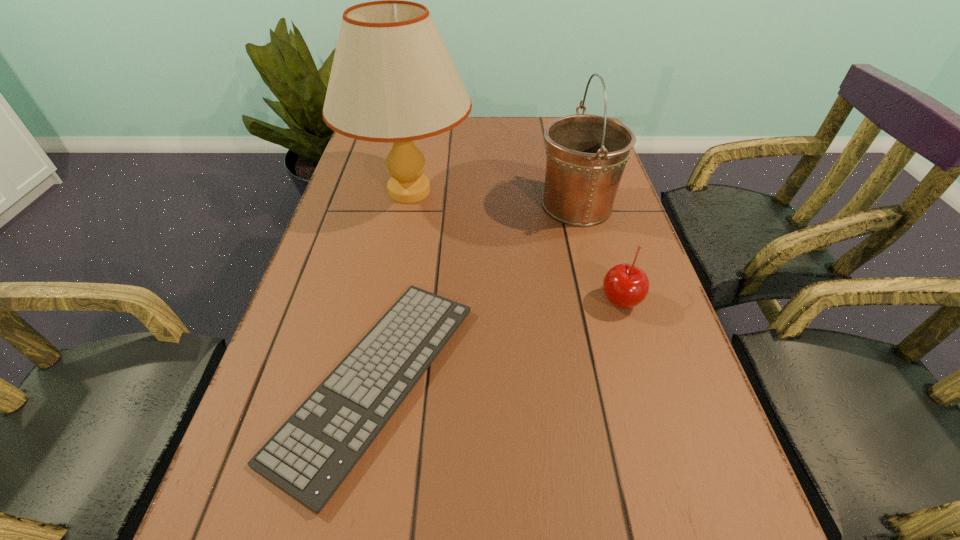
The image size is (960, 540). In order to click on bucket present at the right edge in this screenshot , I will do `click(586, 154)`.

The width and height of the screenshot is (960, 540). I want to click on cherry situated at the right edge, so click(x=625, y=286).

In the image, there is a desktop. Where is `free space at the far edge`? The width and height of the screenshot is (960, 540). free space at the far edge is located at coordinates (466, 144).

In the image, there is a desktop. What are the coordinates of `vacant space at the left edge` in the screenshot? It's located at pos(391,201).

Locate an element on the screen. The height and width of the screenshot is (540, 960). vacant area at the right edge is located at coordinates (592, 244).

Where is `free space between the cherry and the bucket`? free space between the cherry and the bucket is located at coordinates (598, 253).

Where is `vacant point located between the cherry and the lampshade`? The height and width of the screenshot is (540, 960). vacant point located between the cherry and the lampshade is located at coordinates (515, 246).

The height and width of the screenshot is (540, 960). Find the location of `vacant area that lies between the third shortest object and the shortest object`. vacant area that lies between the third shortest object and the shortest object is located at coordinates (476, 293).

Image resolution: width=960 pixels, height=540 pixels. I want to click on free space between the bucket and the third tallest object, so click(x=598, y=253).

Where is `free space between the computer keyboard and the lampshade`? free space between the computer keyboard and the lampshade is located at coordinates (393, 286).